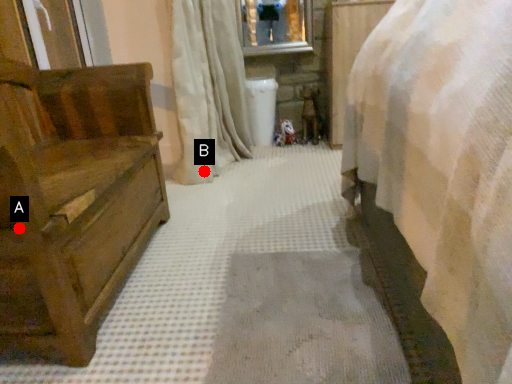
Question: Two points are circled on the image, labeled by A and B beside each circle. Which point is closer to the camera?

Choices:
 (A) A is closer
 (B) B is closer

Answer: (A)